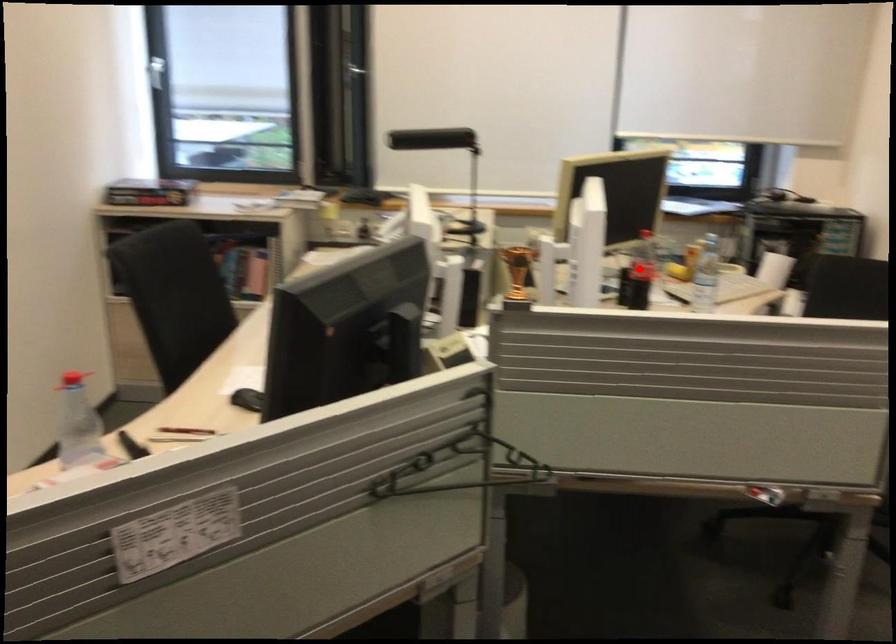
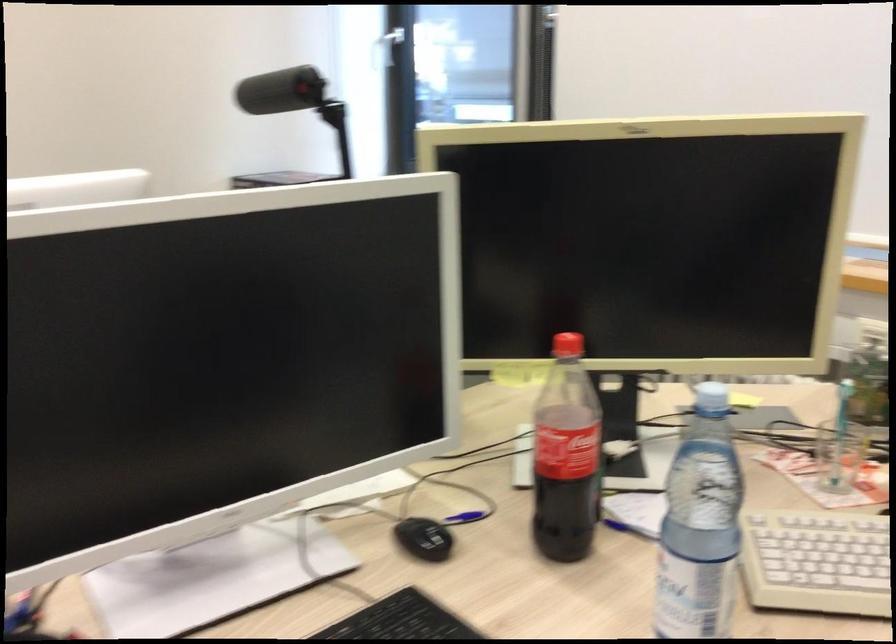
Question: I am providing you with two images of the same scene from different viewpoints. Given a red point in image1, look at the same physical point in image2. Is it:

Choices:
 (A) Closer to the viewpoint
 (B) Farther from the viewpoint

Answer: (A)